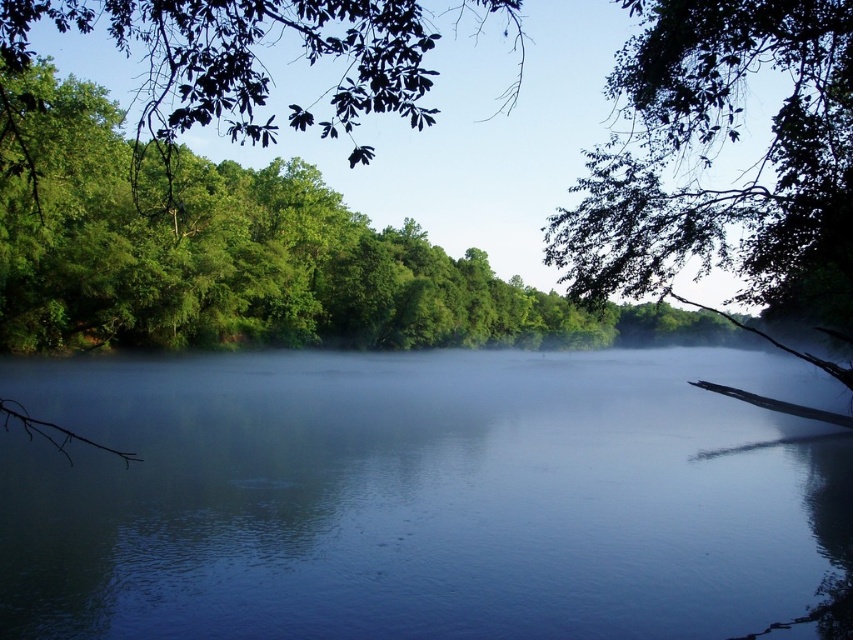
You are standing at the center of the river in the image. Looking towards the upper left corner, you see a point marked at coordinates [228,250]. What object is located at that point?

The point at coordinates [228,250] marks the location of the green leafy tree at upper left.

Looking at this image, you are standing at the edge of the river and want to place a small boat in the blue reflective water at center. Considering the width of the green leafy tree at upper left, will the boat fit comfortably in the water?

The blue reflective water at center has a lesser width compared to the green leafy tree at upper left, so the boat may not fit comfortably as the water is narrower than the tree.